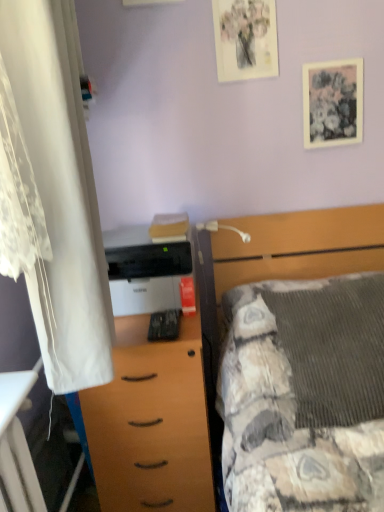
Question: Does white plastic lamp at upper center have a greater height compared to white matte printer at center?

Choices:
 (A) no
 (B) yes

Answer: (A)

Question: Can you confirm if white plastic lamp at upper center is positioned to the left of white matte printer at center?

Choices:
 (A) no
 (B) yes

Answer: (A)

Question: From a real-world perspective, is white plastic lamp at upper center located higher than white matte printer at center?

Choices:
 (A) yes
 (B) no

Answer: (A)

Question: From the image's perspective, is white plastic lamp at upper center located beneath white matte printer at center?

Choices:
 (A) no
 (B) yes

Answer: (A)

Question: Does white plastic lamp at upper center have a greater width compared to white matte printer at center?

Choices:
 (A) no
 (B) yes

Answer: (B)

Question: Is point (261, 2) positioned closer to the camera than point (26, 465)?

Choices:
 (A) farther
 (B) closer

Answer: (A)

Question: From their relative heights in the image, would you say matte floral print at upper center, the first picture frame viewed from the left, is taller or shorter than wooden desk at lower left?

Choices:
 (A) tall
 (B) short

Answer: (B)

Question: Is matte floral print at upper center, arranged as the 2th picture frame when ordered from the bottom, in front of or behind wooden desk at lower left in the image?

Choices:
 (A) behind
 (B) front

Answer: (A)

Question: Would you say matte floral print at upper center, placed as the first picture frame when sorted from top to bottom, is inside or outside wooden desk at lower left?

Choices:
 (A) inside
 (B) outside

Answer: (B)

Question: Based on their sizes in the image, would you say white matte printer at center is bigger or smaller than white lace curtain at left?

Choices:
 (A) big
 (B) small

Answer: (B)

Question: From their relative heights in the image, would you say white matte printer at center is taller or shorter than white lace curtain at left?

Choices:
 (A) tall
 (B) short

Answer: (B)

Question: Is point (150, 288) positioned closer to the camera than point (38, 9)?

Choices:
 (A) closer
 (B) farther

Answer: (B)

Question: Is white matte printer at center situated inside white lace curtain at left or outside?

Choices:
 (A) inside
 (B) outside

Answer: (B)

Question: Does point (215, 222) appear closer or farther from the camera than point (231, 281)?

Choices:
 (A) closer
 (B) farther

Answer: (B)

Question: From a real-world perspective, is white plastic lamp at upper center physically located above or below textured gray blanket at center?

Choices:
 (A) below
 (B) above

Answer: (B)